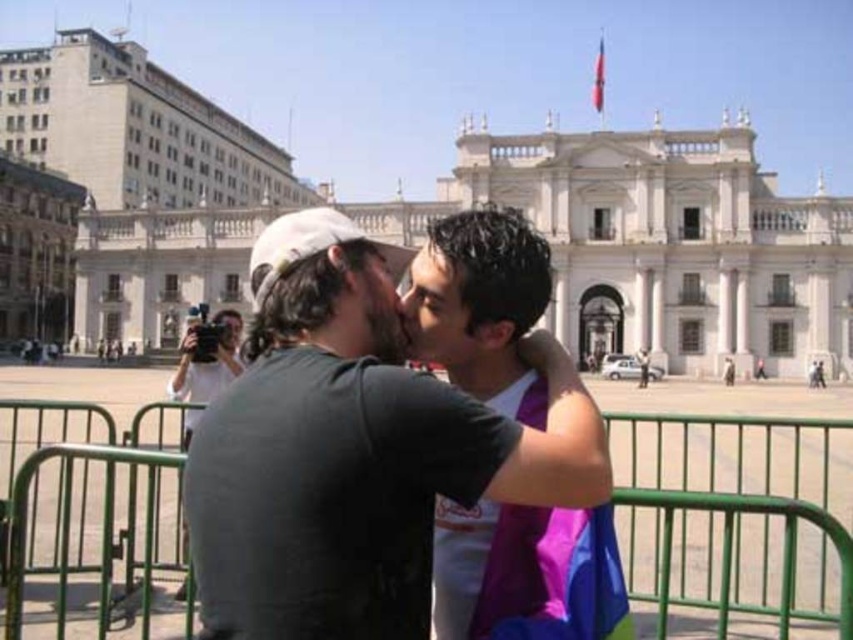
You are a painter setting up an easel in the public square. You want to paint both the green metal fence at center and the purple fabric at center. Which object should you place closer to the front of your canvas to accurately represent their sizes?

The green metal fence at center is wider than the purple fabric at center, so you should place the green metal fence at center closer to the front of the canvas to show its larger size.

You are standing in the public square and want to take a photo of the white stone building at center without the green metal fence at center appearing in the shot. How can you adjust your position to achieve this?

Result: Move closer to the white stone building at center so that it comes between you and the green metal fence at center, thereby blocking the fence from the frame.